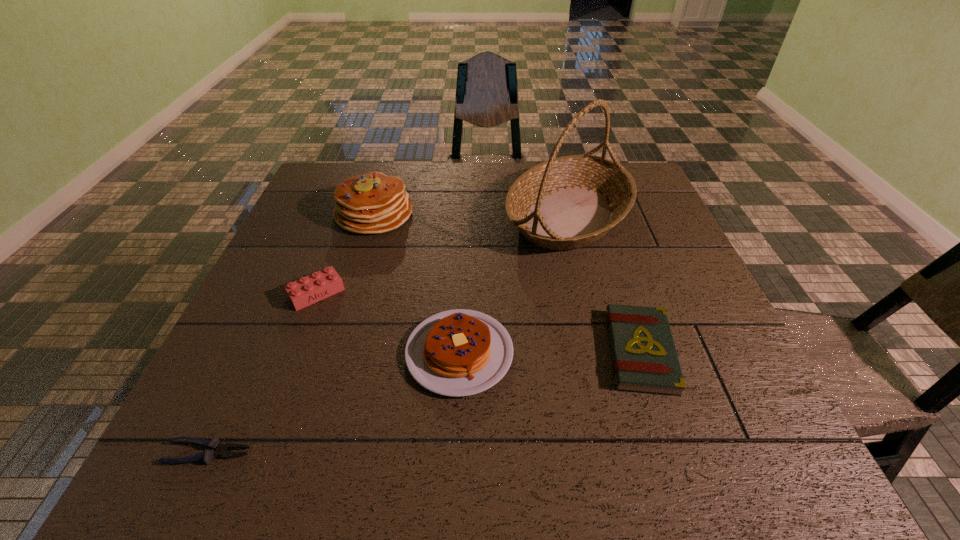
Locate an element on the screen. vacant region located 0.100m on the front of the farther pancake is located at coordinates (360, 262).

Find the location of a particular element. The width and height of the screenshot is (960, 540). vacant region located 0.400m on the back of the right pancake is located at coordinates (466, 210).

The width and height of the screenshot is (960, 540). Find the location of `vacant region located 0.300m on the right of the third farthest object`. vacant region located 0.300m on the right of the third farthest object is located at coordinates (473, 293).

Find the location of a particular element. vacant space located on the left of the fifth tallest object is located at coordinates (434, 352).

The image size is (960, 540). I want to click on free point located 0.220m at the gripping part of the pliers, so click(x=380, y=453).

The image size is (960, 540). Find the location of `basket present at the far edge`. basket present at the far edge is located at coordinates (568, 202).

Where is `pancake that is at the far edge`? The height and width of the screenshot is (540, 960). pancake that is at the far edge is located at coordinates click(372, 203).

Locate an element on the screen. object located in the near edge section of the desktop is located at coordinates (x=217, y=449).

This screenshot has width=960, height=540. In order to click on pancake located in the left edge section of the desktop in this screenshot , I will do coord(372,203).

I want to click on Lego at the left edge, so click(x=308, y=290).